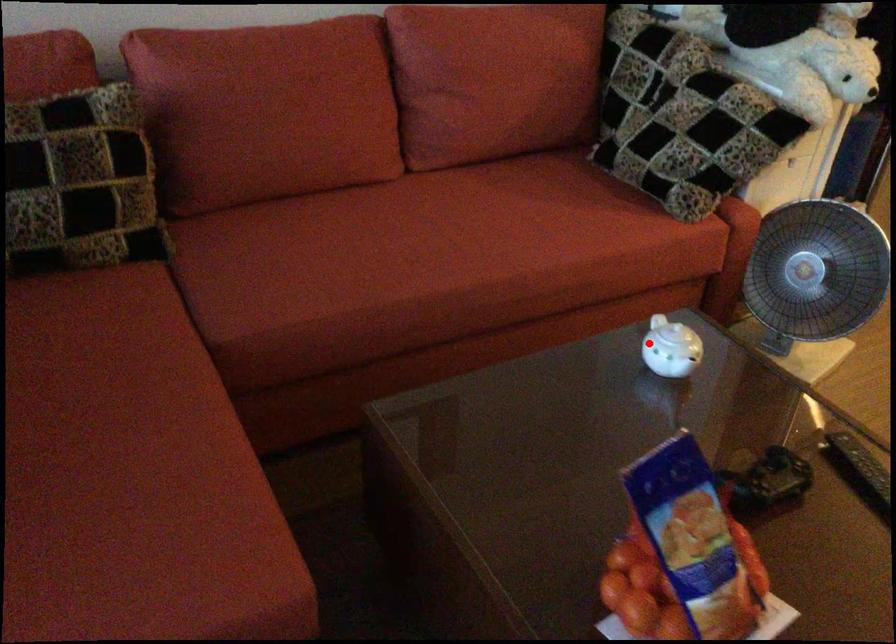
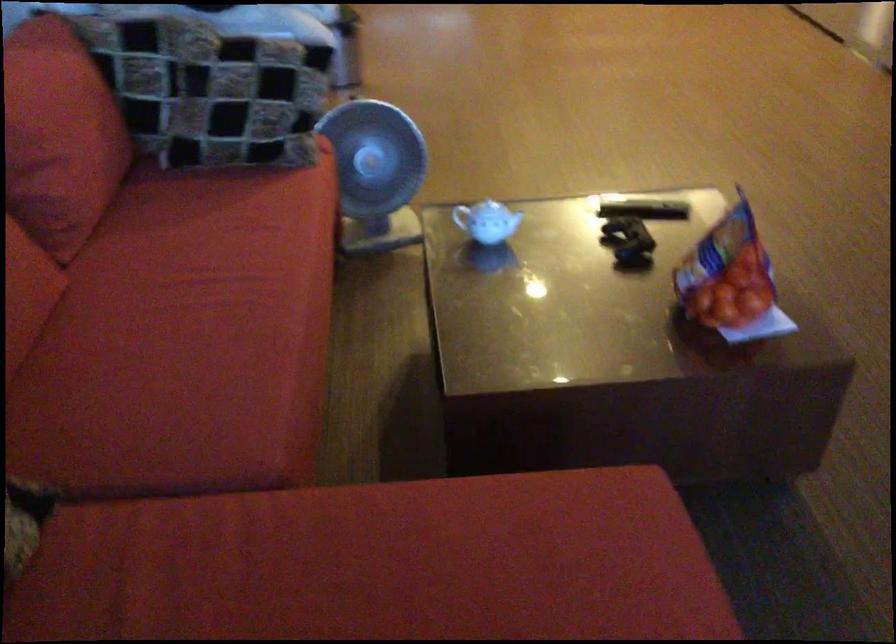
Question: I am providing you with two images of the same scene from different viewpoints. Image1 has a red point marked. In image2, the corresponding 3D location appears at what relative position? Reply with the corresponding letter.

Choices:
 (A) Closer
 (B) Farther

Answer: (B)